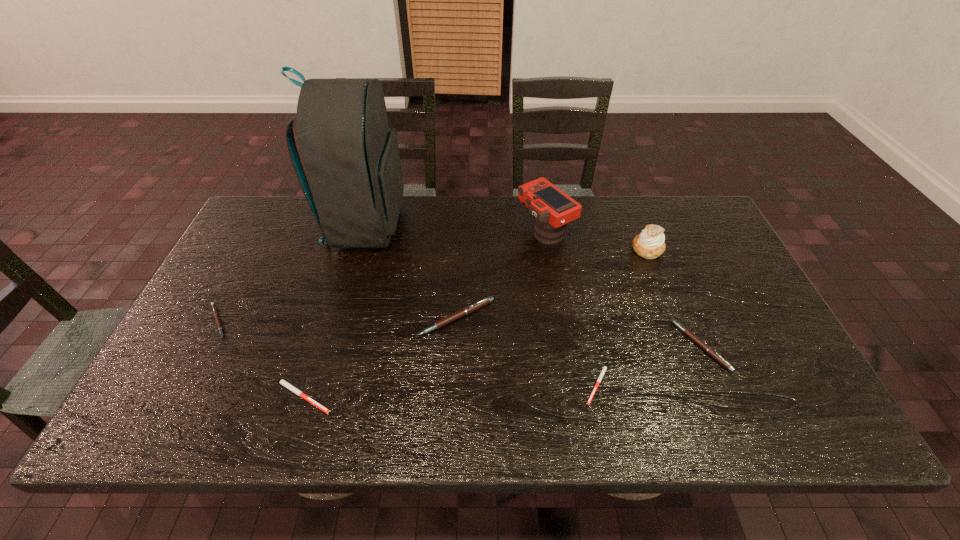
In order to click on vacant region located at the nib of the second biggest pink pen in this screenshot , I will do `click(573, 346)`.

Locate an element on the screen. Image resolution: width=960 pixels, height=540 pixels. free space located 0.180m at the nib of the leftmost pink pen is located at coordinates (303, 321).

The height and width of the screenshot is (540, 960). In order to click on free space located 0.130m on the clicker of the left white pen in this screenshot , I will do `click(396, 396)`.

I want to click on backpack that is at the far edge, so click(x=351, y=157).

Identify the location of camera present at the far edge. This screenshot has width=960, height=540. (552, 208).

At what (x,y) coordinates should I click in order to perform the action: click on pastry present at the far edge. Please return your answer as a coordinate pair (x, y). The width and height of the screenshot is (960, 540). Looking at the image, I should click on (649, 244).

Find the location of a particular element. Image resolution: width=960 pixels, height=540 pixels. object at the left edge is located at coordinates (215, 313).

Where is `object that is at the right edge`? This screenshot has height=540, width=960. object that is at the right edge is located at coordinates (709, 350).

This screenshot has height=540, width=960. Identify the location of vacant area at the far edge of the desktop. (524, 231).

Locate an element on the screen. This screenshot has height=540, width=960. vacant region at the near edge of the desktop is located at coordinates (452, 401).